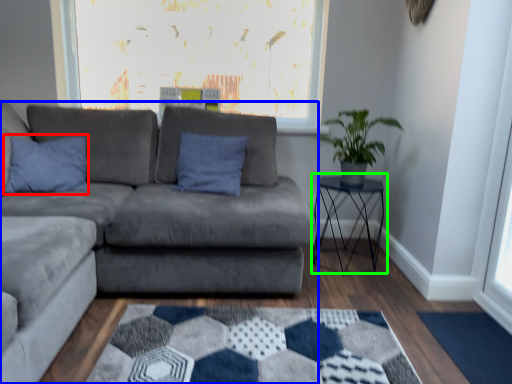
Question: Which object is the closest to the pillow (highlighted by a red box)? Choose among these: studio couch (highlighted by a blue box) or table (highlighted by a green box).

Choices:
 (A) studio couch
 (B) table

Answer: (A)